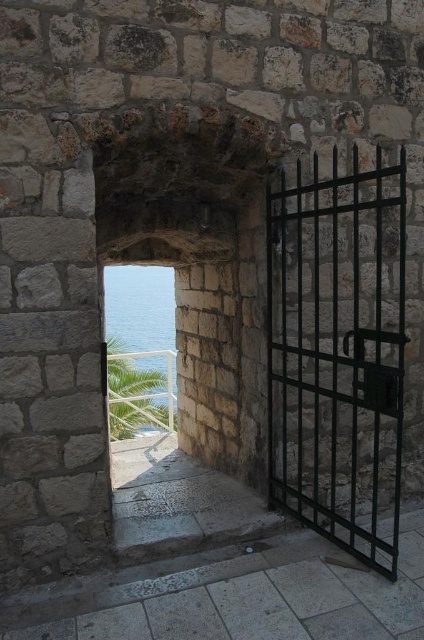
Between black metal gate at right and clear blue water at center, which one is positioned lower?

clear blue water at center is lower down.

Can you confirm if black metal gate at right is taller than clear blue water at center?

Incorrect, black metal gate at right's height is not larger of clear blue water at center's.

Locate an element on the screen. The image size is (424, 640). black metal gate at right is located at coordinates (339, 352).